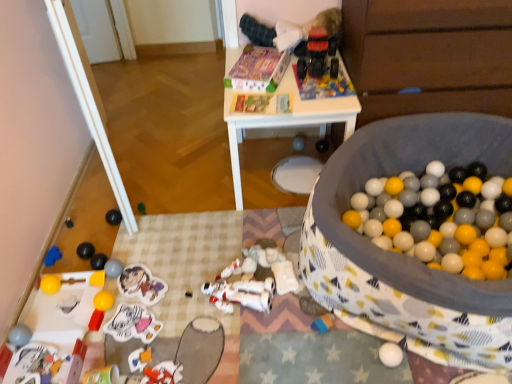
Find the location of a particular element. vacant space positioned to the left of matte white sticker at center, the fourteenth toy when ordered from left to right is located at coordinates (94, 336).